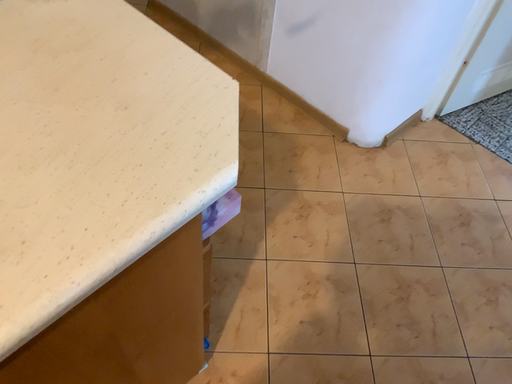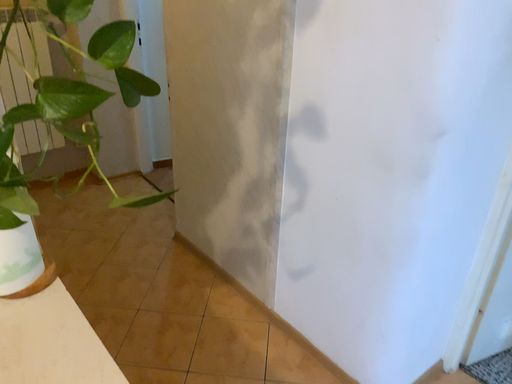
Question: Which way did the camera rotate in the video?

Choices:
 (A) rotated upward
 (B) rotated downward

Answer: (A)